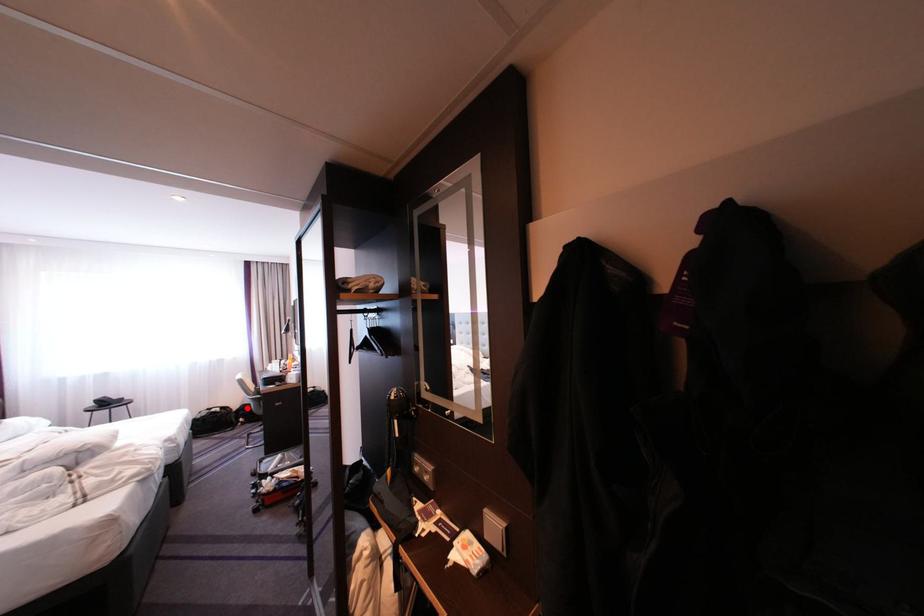
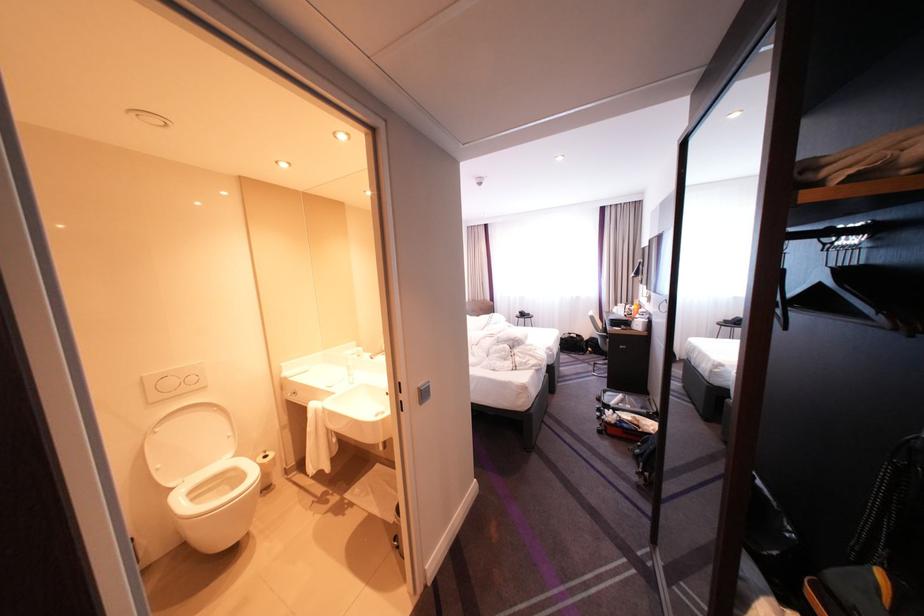
Find the pixel in the second image that matches the highlighted location in the first image.

(599, 338)